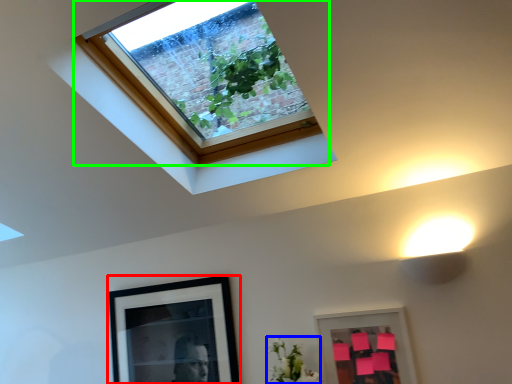
Question: Considering the real-world distances, which object is closest to picture frame (highlighted by a red box)? flower (highlighted by a blue box) or window (highlighted by a green box).

Choices:
 (A) flower
 (B) window

Answer: (A)